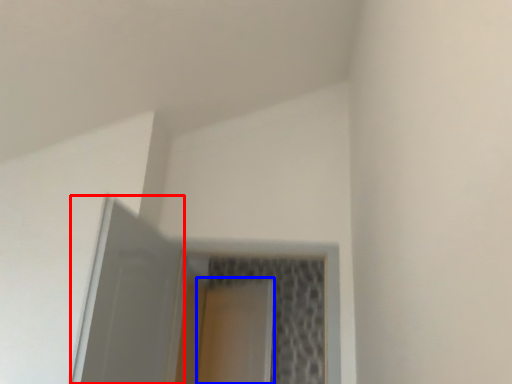
Question: Among these objects, which one is farthest to the camera, screen door (highlighted by a red box) or screen door (highlighted by a blue box)?

Choices:
 (A) screen door
 (B) screen door

Answer: (B)